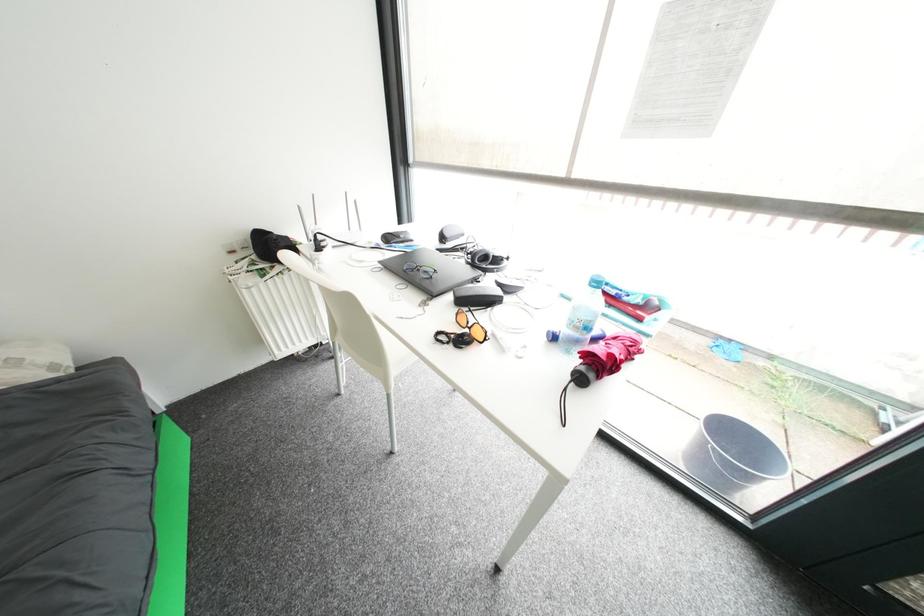
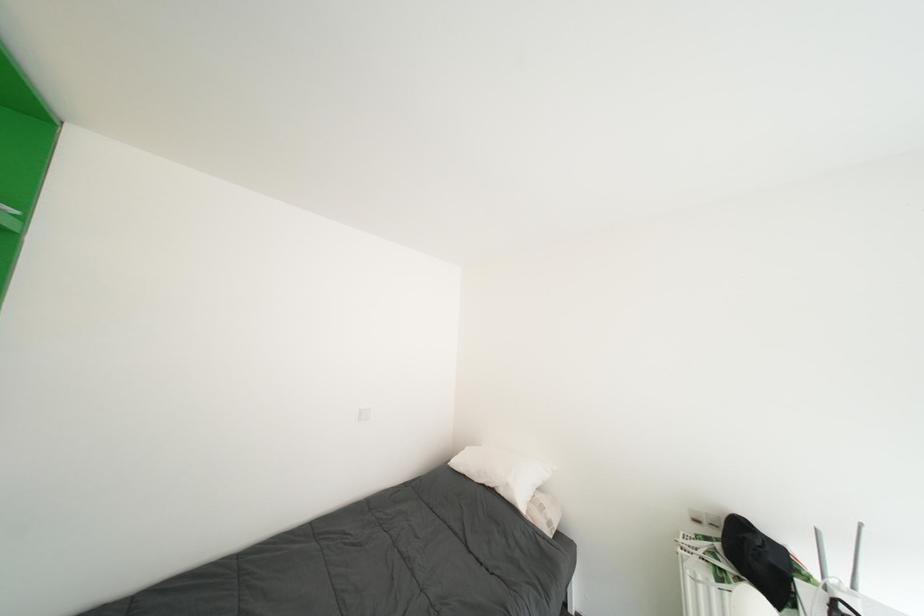
Question: The images are taken continuously from a first-person perspective. In which direction is your viewpoint rotating?

Choices:
 (A) Left
 (B) Right
 (C) Up
 (D) Down

Answer: (A)